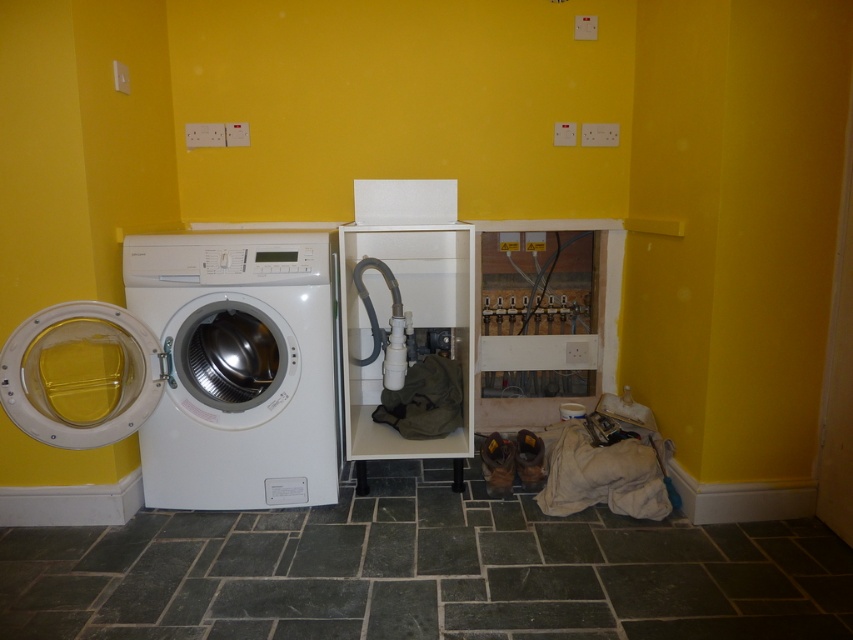
Question: Can you confirm if white glossy washing machine at left is positioned to the left of green fabric laundry at center?

Choices:
 (A) no
 (B) yes

Answer: (B)

Question: Is white glossy cabinet at center positioned behind green fabric laundry at center?

Choices:
 (A) no
 (B) yes

Answer: (A)

Question: Estimate the real-world distances between objects in this image. Which object is farther from the green fabric laundry at center?

Choices:
 (A) beige fabric laundry at lower right
 (B) white glossy cabinet at center

Answer: (A)

Question: Can you confirm if white glossy cabinet at center is positioned to the left of green fabric laundry at center?

Choices:
 (A) yes
 (B) no

Answer: (A)

Question: Which of these objects is positioned closest to the white glossy washing machine at left?

Choices:
 (A) white glossy cabinet at center
 (B) green fabric laundry at center
 (C) beige fabric laundry at lower right

Answer: (A)

Question: Which point is closer to the camera taking this photo?

Choices:
 (A) (646, 509)
 (B) (426, 186)
 (C) (387, 392)

Answer: (A)